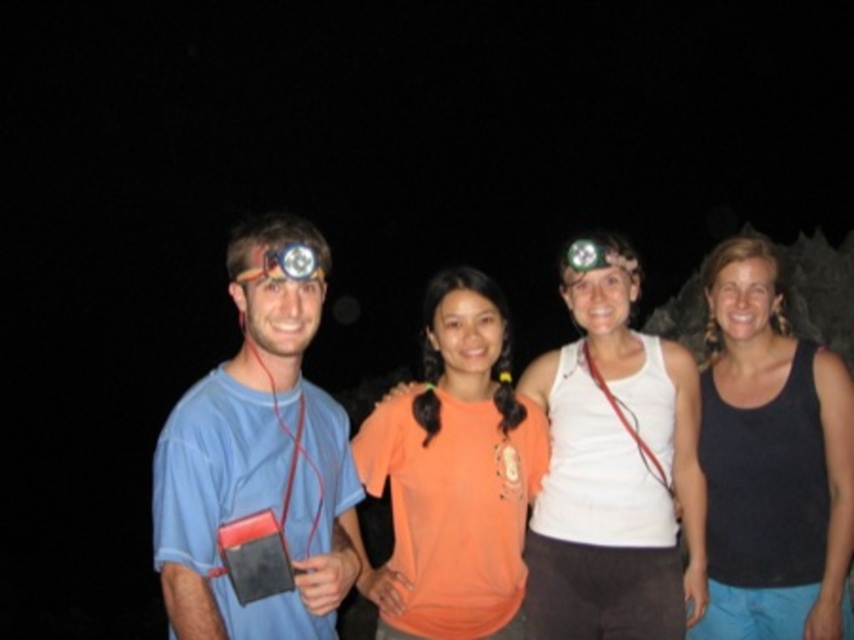
You are standing in the dark and see the orange cotton shirt at center and the matte yellow headlamp at left. Which object is closer to you?

The orange cotton shirt at center is closer to you because it is further to the viewer than the matte yellow headlamp at left.

You are trying to locate the orange cotton shirt at center in a group photo taken at night. Based on the coordinates provided, where would you focus your attention to find it?

The orange cotton shirt at center is located at coordinates point (613, 467), so you should focus your attention there to find it.